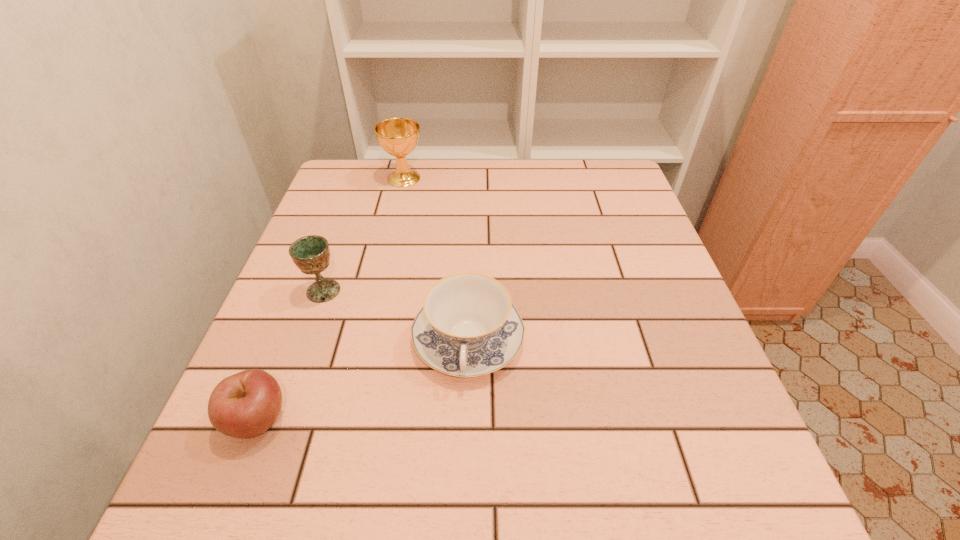
This screenshot has width=960, height=540. Find the location of `empty space that is in between the left chalice and the tallest object`. empty space that is in between the left chalice and the tallest object is located at coordinates (364, 234).

Locate an element on the screen. This screenshot has width=960, height=540. free space that is in between the left chalice and the chinaware is located at coordinates (396, 316).

Where is `free space that is in between the shortest object and the chinaware`? The width and height of the screenshot is (960, 540). free space that is in between the shortest object and the chinaware is located at coordinates pyautogui.click(x=363, y=380).

Find the location of a particular element. This screenshot has height=540, width=960. empty space that is in between the chinaware and the apple is located at coordinates (363, 380).

Where is `free space between the rightmost object and the shortest object`? The height and width of the screenshot is (540, 960). free space between the rightmost object and the shortest object is located at coordinates (363, 380).

Locate an element on the screen. The image size is (960, 540). free space between the third object from left to right and the chinaware is located at coordinates (436, 260).

The width and height of the screenshot is (960, 540). Find the location of `vacant area that lies between the rightmost object and the shortest object`. vacant area that lies between the rightmost object and the shortest object is located at coordinates pyautogui.click(x=363, y=380).

Locate an element on the screen. free space between the apple and the chinaware is located at coordinates (363, 380).

I want to click on vacant space in between the left chalice and the apple, so click(x=291, y=355).

Image resolution: width=960 pixels, height=540 pixels. I want to click on free spot between the left chalice and the taller chalice, so (364, 234).